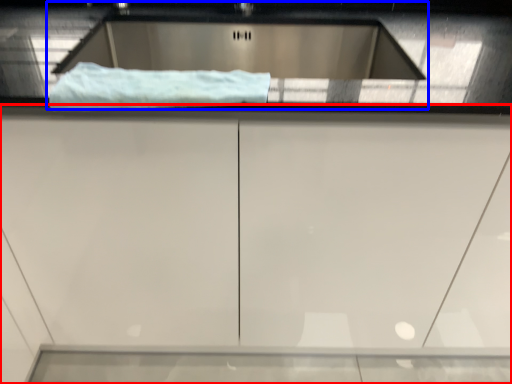
Question: Which point is further to the camera, cabinetry (highlighted by a red box) or sink (highlighted by a blue box)?

Choices:
 (A) cabinetry
 (B) sink

Answer: (B)